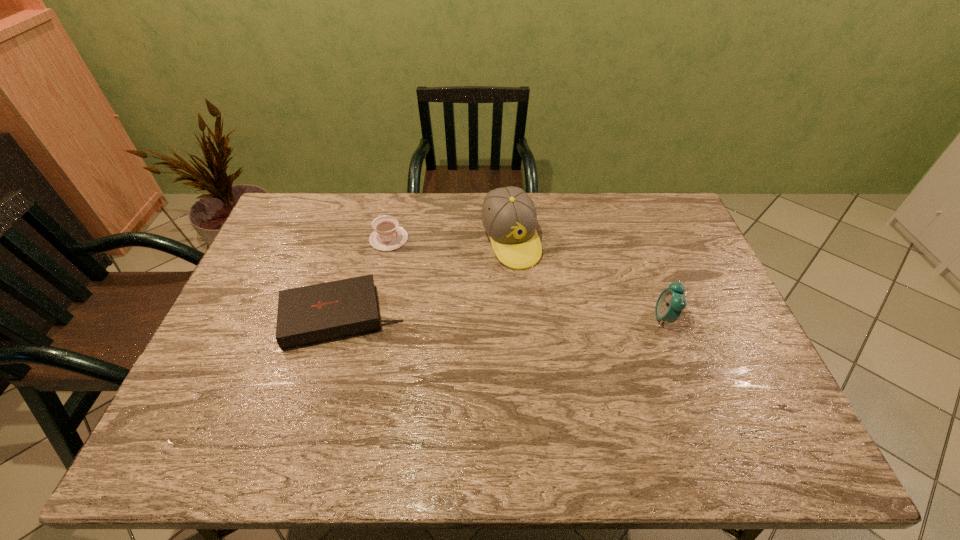
Locate an element on the screen. The width and height of the screenshot is (960, 540). free spot at the far edge of the desktop is located at coordinates (608, 204).

The width and height of the screenshot is (960, 540). In the image, there is a desktop. Identify the location of vacant space at the near edge. (379, 410).

Find the location of a particular element. Image resolution: width=960 pixels, height=540 pixels. vacant area at the left edge of the desktop is located at coordinates (221, 338).

Find the location of a particular element. vacant space at the right edge of the desktop is located at coordinates (714, 320).

Identify the location of free space at the far right corner. The image size is (960, 540). (642, 205).

This screenshot has width=960, height=540. I want to click on unoccupied position between the teacup and the alarm clock, so 527,278.

At what (x,y) coordinates should I click in order to perform the action: click on free spot between the baseball cap and the Bible. Please return your answer as a coordinate pair (x, y). Looking at the image, I should click on (426, 279).

The image size is (960, 540). What are the coordinates of `blank region between the third tallest object and the second object from right to left` in the screenshot? It's located at (449, 240).

Locate an element on the screen. This screenshot has width=960, height=540. blank region between the third shortest object and the baseball cap is located at coordinates (588, 279).

The height and width of the screenshot is (540, 960). In order to click on vacant point located between the Bible and the third object from left to right in this screenshot , I will do `click(426, 279)`.